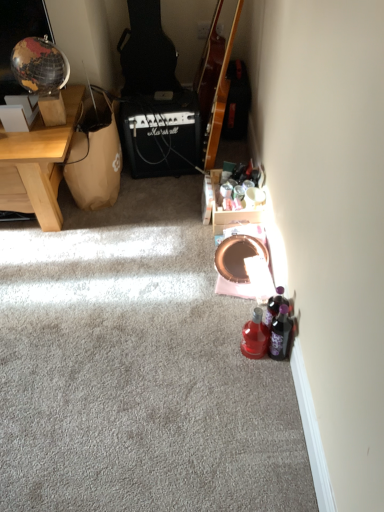
Question: From a real-world perspective, is translucent purple bottle at lower right, marked as the 2th bottle in a left-to-right arrangement, located beneath black matte marshall amplifier at center?

Choices:
 (A) no
 (B) yes

Answer: (B)

Question: Does translucent purple bottle at lower right, marked as the 2th bottle in a left-to-right arrangement, appear on the left side of black matte marshall amplifier at center?

Choices:
 (A) no
 (B) yes

Answer: (A)

Question: Is translucent purple bottle at lower right, which is the 2th bottle in right-to-left order, shorter than black matte marshall amplifier at center?

Choices:
 (A) no
 (B) yes

Answer: (B)

Question: From a real-world perspective, does translucent purple bottle at lower right, marked as the 2th bottle in a left-to-right arrangement, stand above black matte marshall amplifier at center?

Choices:
 (A) yes
 (B) no

Answer: (B)

Question: Is translucent purple bottle at lower right, which is the 2th bottle in right-to-left order, in front of black matte marshall amplifier at center?

Choices:
 (A) yes
 (B) no

Answer: (A)

Question: Is glossy wood guitar at upper center taller or shorter than purple matte bottle at lower right, marked as the 1th bottle in a right-to-left arrangement?

Choices:
 (A) tall
 (B) short

Answer: (A)

Question: From a real-world perspective, is glossy wood guitar at upper center positioned above or below purple matte bottle at lower right, marked as the 1th bottle in a right-to-left arrangement?

Choices:
 (A) above
 (B) below

Answer: (A)

Question: Is glossy wood guitar at upper center situated inside purple matte bottle at lower right, marked as the 1th bottle in a right-to-left arrangement, or outside?

Choices:
 (A) inside
 (B) outside

Answer: (B)

Question: Based on their sizes in the image, would you say glossy wood guitar at upper center is bigger or smaller than purple matte bottle at lower right, marked as the third bottle in a left-to-right arrangement?

Choices:
 (A) small
 (B) big

Answer: (B)

Question: From the image's perspective, is black matte marshall amplifier at center positioned above or below white cardboard box at upper left?

Choices:
 (A) below
 (B) above

Answer: (B)

Question: From a real-world perspective, is black matte marshall amplifier at center physically located above or below white cardboard box at upper left?

Choices:
 (A) below
 (B) above

Answer: (A)

Question: From their relative heights in the image, would you say black matte marshall amplifier at center is taller or shorter than white cardboard box at upper left?

Choices:
 (A) tall
 (B) short

Answer: (A)

Question: Does point (x=130, y=105) appear closer or farther from the camera than point (x=8, y=118)?

Choices:
 (A) farther
 (B) closer

Answer: (A)

Question: In the image, is brown paper bag at left positioned in front of or behind black matte marshall amplifier at center?

Choices:
 (A) front
 (B) behind

Answer: (A)

Question: From the image's perspective, is brown paper bag at left above or below black matte marshall amplifier at center?

Choices:
 (A) below
 (B) above

Answer: (A)